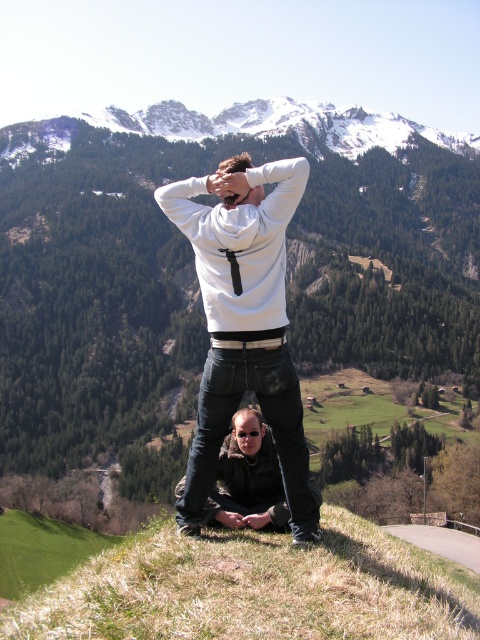
Between point (142, 124) and point (239, 416), which one is positioned behind?

The point (142, 124) is more distant.

Is snowy granite mountain at upper center above smooth skin forehead at center?

Yes.

You are a GUI agent. You are given a task and a screenshot of the screen. Output one action in this format:
    pyautogui.click(x=<x>, y=<y>)
    Task: Click on the snowy granite mountain at upper center
    The width and height of the screenshot is (480, 640).
    Given the screenshot: What is the action you would take?
    coord(284,125)

Measure the distance between white matte hoodie at center and camera.

white matte hoodie at center is 57.69 meters away from camera.

Between white matte hoodie at center and smooth skin forehead at center, which one has more height?

With more height is white matte hoodie at center.

Locate an element on the screen. The image size is (480, 640). white matte hoodie at center is located at coordinates (243, 323).

Can you confirm if snowy granite mountain at upper center is bigger than black leather jacket at lower center?

Indeed, snowy granite mountain at upper center has a larger size compared to black leather jacket at lower center.

Does snowy granite mountain at upper center lie behind black leather jacket at lower center?

That is True.

Is point (172, 129) farther from viewer compared to point (279, 516)?

That is True.

This screenshot has width=480, height=640. Find the location of `snowy granite mountain at upper center`. snowy granite mountain at upper center is located at coordinates 284,125.